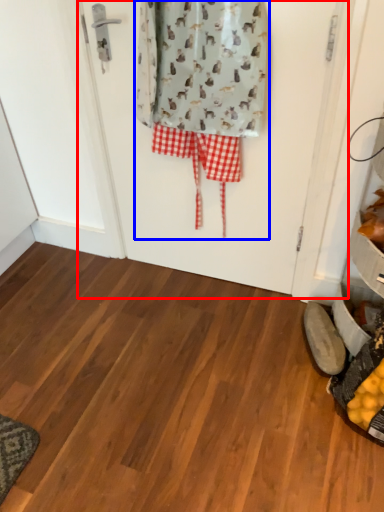
Question: Which object appears closest to the camera in this image, screen door (highlighted by a red box) or laundry (highlighted by a blue box)?

Choices:
 (A) screen door
 (B) laundry

Answer: (B)